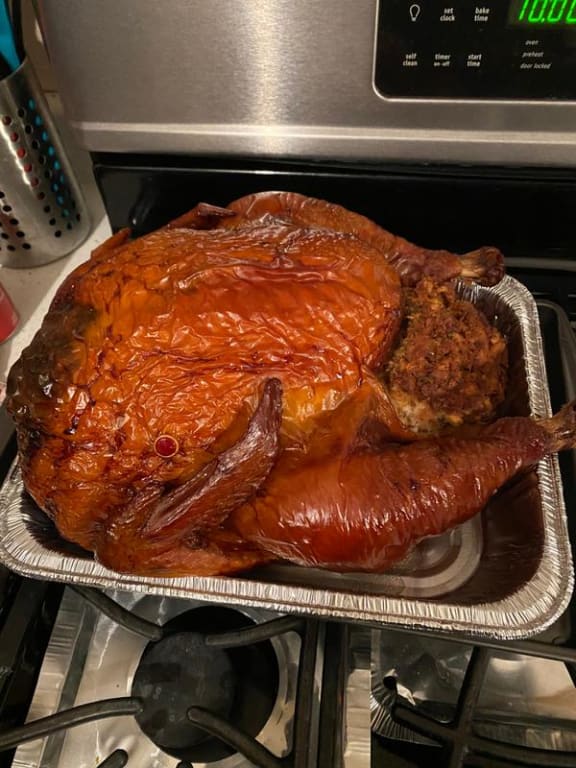
What are the coordinates of `stove` in the screenshot? It's located at (445, 48).